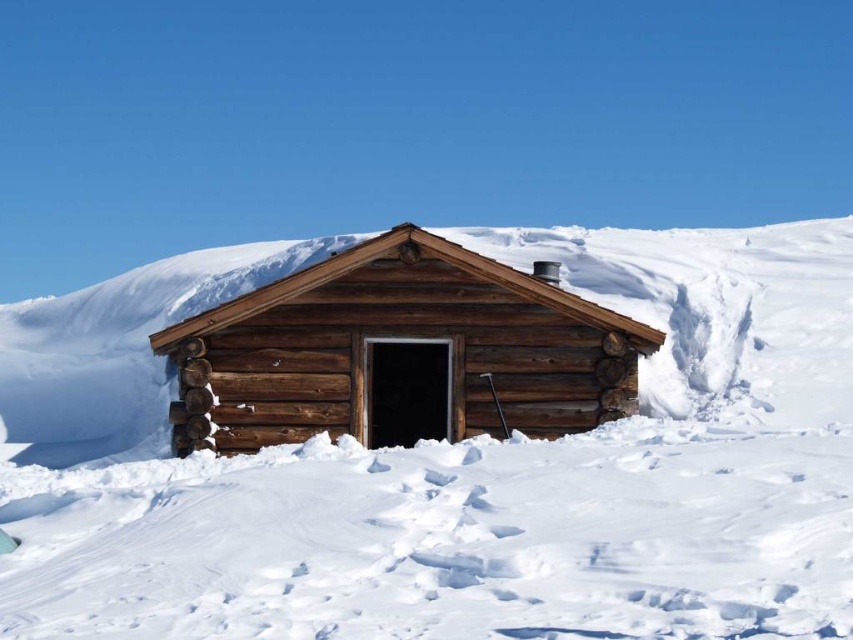
You are planning to build a snowman using the white fluffy snow at center near the natural wood log cabin at center. Considering the size of the snow and the cabin, will you have enough snow to make a snowman that is taller than the cabin?

The white fluffy snow at center is larger in size than natural wood log cabin at center, so yes, there is enough snow to make a snowman taller than the cabin.

Consider the image. You are standing near the rustic wooden cabin and want to check if you can safely walk towards the white fluffy snow at center without getting too close. If your safe distance is 5 meters, can you step forward one meter and still stay within the safe zone?

The white fluffy snow at center is 5.07 meters away. If you step forward one meter, your distance becomes 4.07 meters, which is within the 5 meter safe zone.

You are standing at the entrance of the rustic wooden cabin with an open door. You notice a point marked at coordinates [451,467]. What is located at that point?

The point at coordinates [451,467] marks white fluffy snow at center.